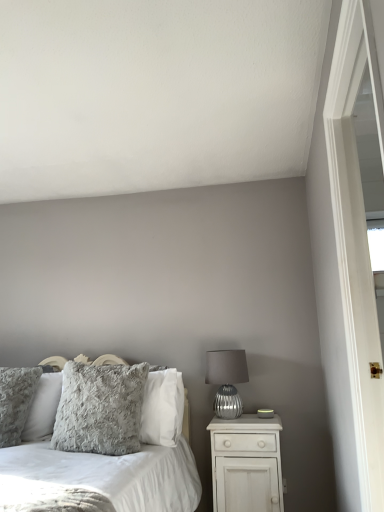
Question: Based on their sizes in the image, would you say white wooden screen door at right is bigger or smaller than matte silver glass table lamp at right?

Choices:
 (A) big
 (B) small

Answer: (A)

Question: Is point (352, 222) closer or farther from the camera than point (216, 378)?

Choices:
 (A) closer
 (B) farther

Answer: (A)

Question: Considering the real-world distances, which object is closest to the fluffy gray pillow at center, the second pillow when ordered from left to right?

Choices:
 (A) white matte nightstand at lower right
 (B) fluffy gray pillow at left, arranged as the second pillow when viewed from the right
 (C) matte silver glass table lamp at right
 (D) fluffy gray pillows at left
 (E) white wooden screen door at right

Answer: (D)

Question: Estimate the real-world distances between objects in this image. Which object is farther from the fluffy gray pillow at center, the second pillow when ordered from left to right?

Choices:
 (A) white matte nightstand at lower right
 (B) white wooden screen door at right
 (C) fluffy gray pillow at left, which is counted as the 1th pillow, starting from the left
 (D) fluffy gray pillows at left
 (E) matte silver glass table lamp at right

Answer: (B)